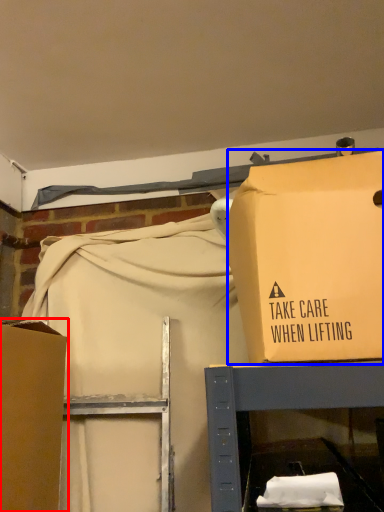
Question: Among these objects, which one is farthest to the camera, box (highlighted by a red box) or box (highlighted by a blue box)?

Choices:
 (A) box
 (B) box

Answer: (A)